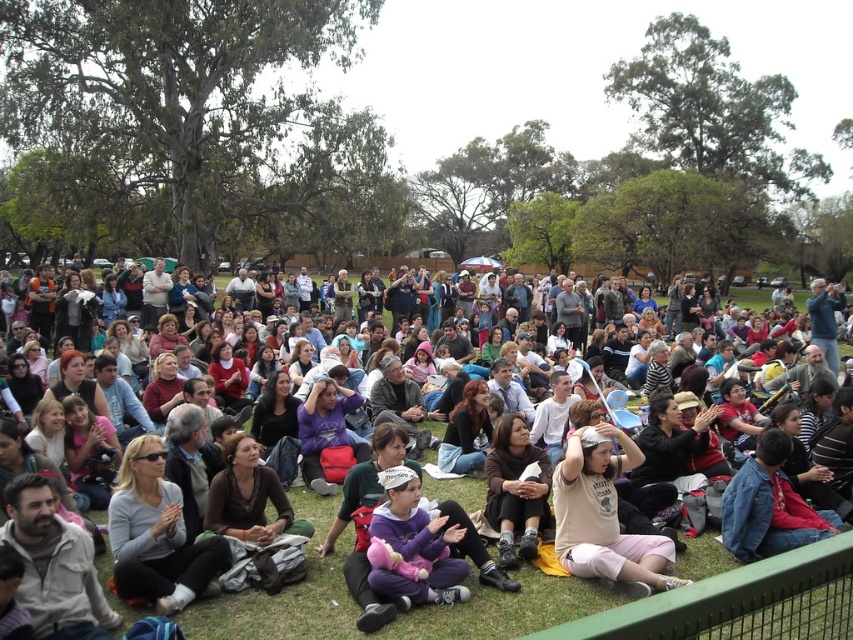
You are standing in the park and see the light pink cotton pants at center. If you want to throw a small ball to someone wearing those pants, can you reach them from where you are standing?

The light pink cotton pants at center are 15.59 meters away from the viewer. Assuming a typical throwing distance for a small ball is around 20 meters, you should be able to reach them, but it might require a strong throw.

You are standing at the back of the crowd in the park and want to see the performance. There is a person with light pink cotton pants at center and dark brown hair at center blocking your view. Which of these two is closer to you, making it harder to see around?

The light pink cotton pants at center is closer to the viewer than dark brown hair at center, so the light pink cotton pants at center is closer to you and blocking your view more.